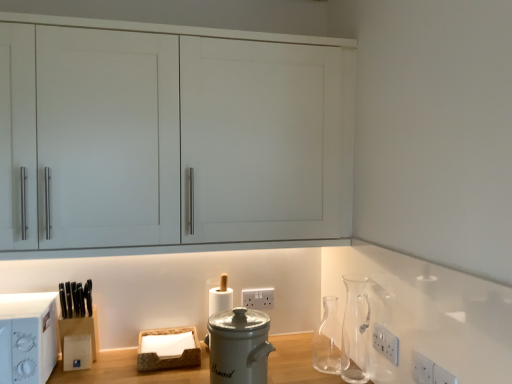
Question: Is white plastic electric outlet at lower right, acting as the 1th electric outlet starting from the right, thinner than white plastic microwave at left?

Choices:
 (A) no
 (B) yes

Answer: (B)

Question: Would you consider white plastic electric outlet at lower right, placed as the 4th electric outlet when sorted from back to front, to be distant from white plastic microwave at left?

Choices:
 (A) no
 (B) yes

Answer: (B)

Question: Does white plastic electric outlet at lower right, acting as the 1th electric outlet starting from the right, have a larger size compared to white plastic microwave at left?

Choices:
 (A) yes
 (B) no

Answer: (B)

Question: Is white plastic electric outlet at lower right, placed as the 4th electric outlet when sorted from back to front, wider than white plastic microwave at left?

Choices:
 (A) no
 (B) yes

Answer: (A)

Question: Is white plastic microwave at left surrounded by white plastic electric outlet at lower right, acting as the 1th electric outlet starting from the right?

Choices:
 (A) no
 (B) yes

Answer: (A)

Question: Is transparent glass carafe at center-right inside or outside of white plastic electric outlet at lower center, acting as the 1th electric outlet starting from the back?

Choices:
 (A) inside
 (B) outside

Answer: (B)

Question: Considering their positions, is transparent glass carafe at center-right located in front of or behind white plastic electric outlet at lower center, arranged as the fourth electric outlet when viewed from the front?

Choices:
 (A) behind
 (B) front

Answer: (B)

Question: Is transparent glass carafe at center-right taller or shorter than white plastic electric outlet at lower center, the 1th electric outlet viewed from the left?

Choices:
 (A) tall
 (B) short

Answer: (A)

Question: From the image's perspective, is transparent glass carafe at center-right located above or below white plastic electric outlet at lower center, acting as the 1th electric outlet starting from the back?

Choices:
 (A) above
 (B) below

Answer: (B)

Question: From a real-world perspective, relative to white plastic electric outlet at lower center, the 1th electric outlet viewed from the left, is white matte cabinet at upper center vertically above or below?

Choices:
 (A) below
 (B) above

Answer: (B)

Question: Based on their sizes in the image, would you say white matte cabinet at upper center is bigger or smaller than white plastic electric outlet at lower center, arranged as the fourth electric outlet when viewed from the front?

Choices:
 (A) small
 (B) big

Answer: (B)

Question: From the image's perspective, relative to white plastic electric outlet at lower center, arranged as the fourth electric outlet when viewed from the front, is white matte cabinet at upper center above or below?

Choices:
 (A) below
 (B) above

Answer: (B)

Question: Choose the correct answer: Is white matte cabinet at upper center inside white plastic electric outlet at lower center, arranged as the fourth electric outlet when viewed from the front, or outside it?

Choices:
 (A) outside
 (B) inside

Answer: (A)

Question: In terms of height, does white plastic electric outlet at lower right, the 3th electric outlet from the left, look taller or shorter compared to white plastic electric outlet at lower center, the 1th electric outlet viewed from the left?

Choices:
 (A) tall
 (B) short

Answer: (B)

Question: From a real-world perspective, is white plastic electric outlet at lower right, the 3th electric outlet from the left, physically located above or below white plastic electric outlet at lower center, arranged as the fourth electric outlet when viewed from the front?

Choices:
 (A) above
 (B) below

Answer: (B)